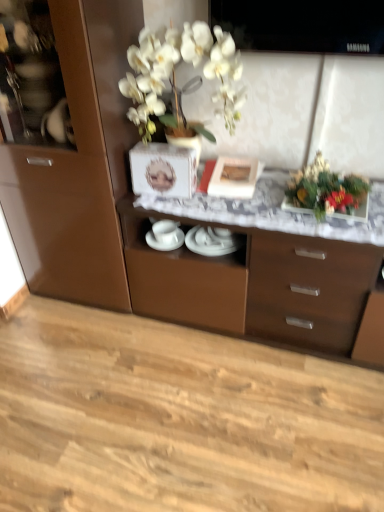
Find the location of a particular element. The image size is (384, 512). vacant space that is in between shiny metallic vase at upper right and matte white picture frame at center is located at coordinates pos(266,190).